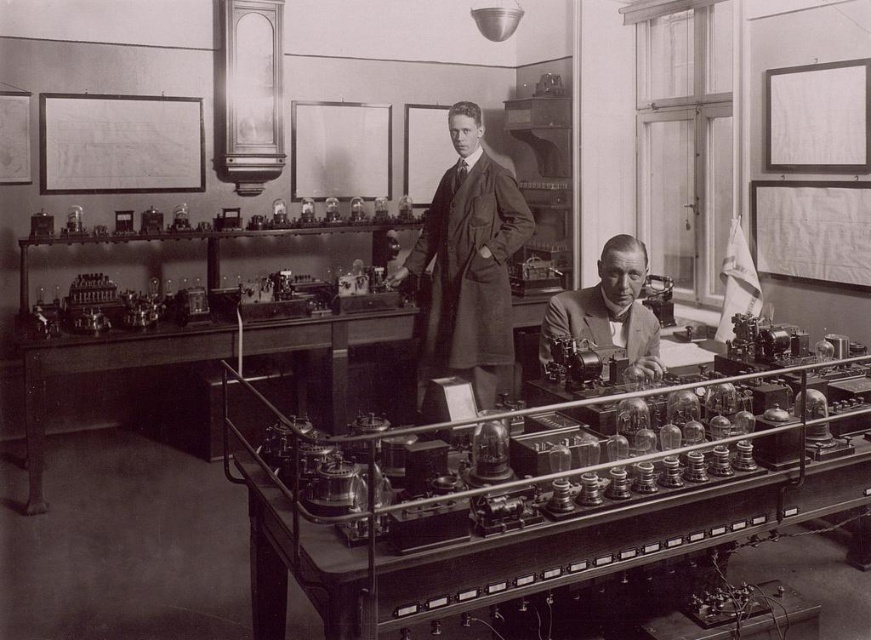
Which is below, metallic glass tubes at center or light brown suit at center?

metallic glass tubes at center

Locate an element on the screen. Image resolution: width=871 pixels, height=640 pixels. metallic glass tubes at center is located at coordinates (525, 508).

Is point (238, 470) positioned behind point (640, 342)?

Yes, point (238, 470) is behind point (640, 342).

The image size is (871, 640). In order to click on metallic glass tubes at center in this screenshot , I will do `click(525, 508)`.

Does matte dark brown suit at center have a greater height compared to light brown suit at center?

Yes, matte dark brown suit at center is taller than light brown suit at center.

Between matte dark brown suit at center and light brown suit at center, which one has less height?

Standing shorter between the two is light brown suit at center.

Describe the element at coordinates (469, 264) in the screenshot. I see `matte dark brown suit at center` at that location.

Identify the location of matte dark brown suit at center. The height and width of the screenshot is (640, 871). (469, 264).

Can you confirm if metallic glass tubes at center is positioned above matte dark brown suit at center?

No.

Does point (312, 464) lie in front of point (471, 305)?

Yes, it is.

Where is `metallic glass tubes at center`? metallic glass tubes at center is located at coordinates (525, 508).